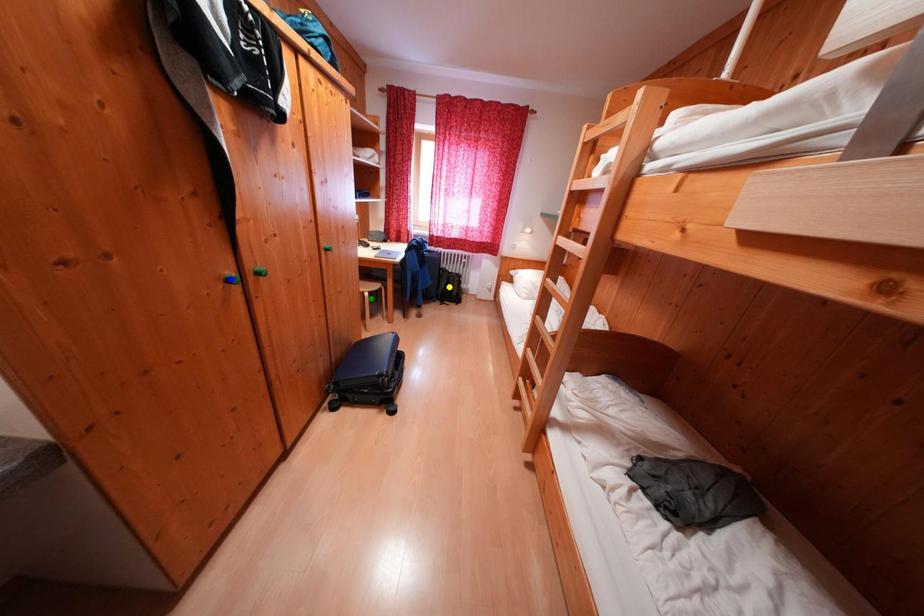
Order these from nearest to farthest:
blue point | green point | yellow point

1. yellow point
2. green point
3. blue point